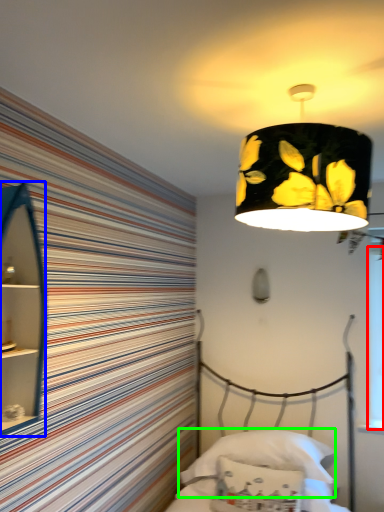
Question: Considering the real-world distances, which object is closest to window screen (highlighted by a red box)? cabinet (highlighted by a blue box) or pillow (highlighted by a green box).

Choices:
 (A) cabinet
 (B) pillow

Answer: (B)